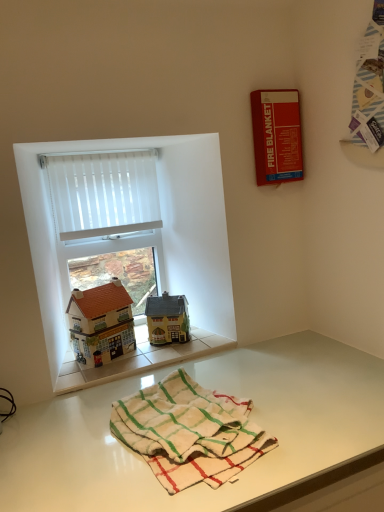
Where is `vacant space in front of matte brown house at left, the 1th toy from the left`? This screenshot has width=384, height=512. vacant space in front of matte brown house at left, the 1th toy from the left is located at coordinates (97, 374).